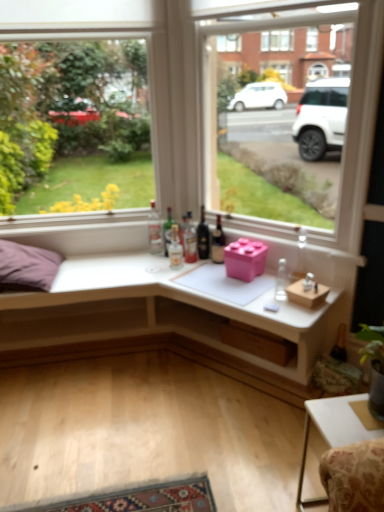
Find the location of a particular element. The height and width of the screenshot is (512, 384). free space in front of dark glass bottle at center, which is the 5th bottle in left-to-right order is located at coordinates (199, 267).